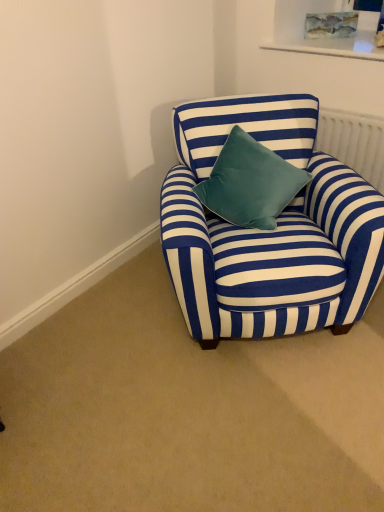
In order to click on empty space that is ontop of white textured radiator at upper right (from a real-world perspective) in this screenshot , I will do (x=357, y=112).